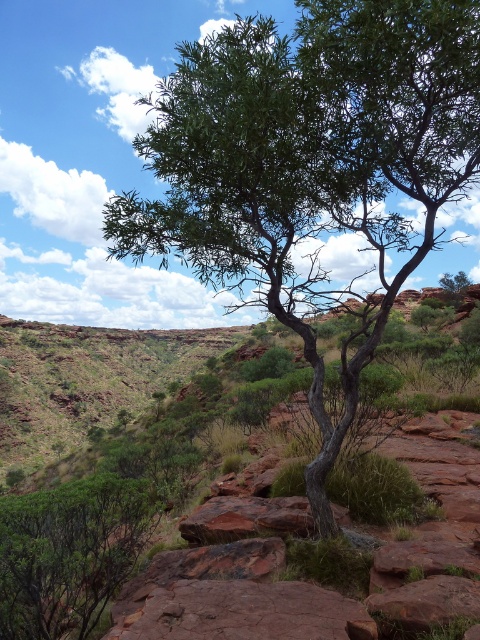
You are standing in the arid landscape and want to walk from the point at coordinates point (25,621) to the point at coordinates point (286,634). Which direction should you face to move towards the second point?

Since point (25,621) is closer to you than point (286,634), you should face away from yourself to move towards the second point.